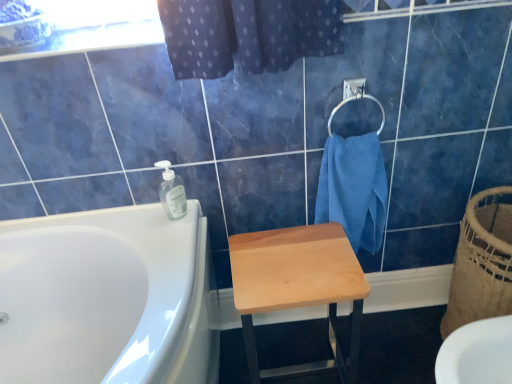
Question: From the image's perspective, does clear plastic soap dispenser at upper center appear higher than silver metallic towel bar at upper right?

Choices:
 (A) no
 (B) yes

Answer: (A)

Question: Does clear plastic soap dispenser at upper center have a greater height compared to silver metallic towel bar at upper right?

Choices:
 (A) no
 (B) yes

Answer: (A)

Question: Does clear plastic soap dispenser at upper center have a lesser width compared to silver metallic towel bar at upper right?

Choices:
 (A) yes
 (B) no

Answer: (B)

Question: Is clear plastic soap dispenser at upper center positioned with its back to silver metallic towel bar at upper right?

Choices:
 (A) yes
 (B) no

Answer: (B)

Question: Is clear plastic soap dispenser at upper center completely or partially outside of silver metallic towel bar at upper right?

Choices:
 (A) no
 (B) yes

Answer: (B)

Question: From a real-world perspective, relative to blue cotton towel at upper right, is silver metallic towel bar at upper right vertically above or below?

Choices:
 (A) below
 (B) above

Answer: (B)

Question: Is silver metallic towel bar at upper right in front of or behind blue cotton towel at upper right in the image?

Choices:
 (A) front
 (B) behind

Answer: (A)

Question: Is silver metallic towel bar at upper right to the left or to the right of blue cotton towel at upper right in the image?

Choices:
 (A) right
 (B) left

Answer: (B)

Question: Is point (365, 97) closer or farther from the camera than point (356, 180)?

Choices:
 (A) closer
 (B) farther

Answer: (A)

Question: From a real-world perspective, is silver metallic towel bar at upper right physically located above or below natural woven basket at right?

Choices:
 (A) below
 (B) above

Answer: (B)

Question: Does point (344, 99) appear closer or farther from the camera than point (499, 223)?

Choices:
 (A) closer
 (B) farther

Answer: (A)

Question: Would you say silver metallic towel bar at upper right is to the left or to the right of natural woven basket at right in the picture?

Choices:
 (A) right
 (B) left

Answer: (B)

Question: In the image, is silver metallic towel bar at upper right positioned in front of or behind natural woven basket at right?

Choices:
 (A) behind
 (B) front

Answer: (A)

Question: Is point (98, 14) closer or farther from the camera than point (377, 130)?

Choices:
 (A) closer
 (B) farther

Answer: (B)

Question: From the image's perspective, is transparent glass window screen at upper left above or below silver metallic towel bar at upper right?

Choices:
 (A) below
 (B) above

Answer: (B)